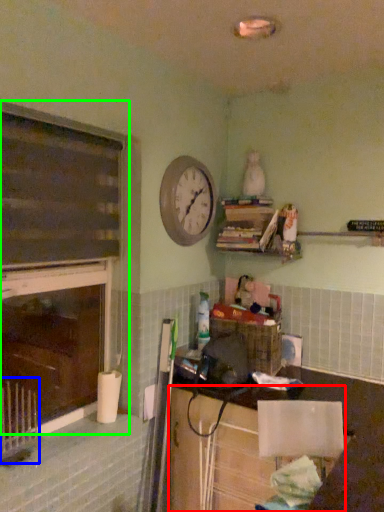
Question: Which is farther away from cabinetry (highlighted by a red box)? radiator (highlighted by a blue box) or window frame (highlighted by a green box)?

Choices:
 (A) radiator
 (B) window frame

Answer: (A)